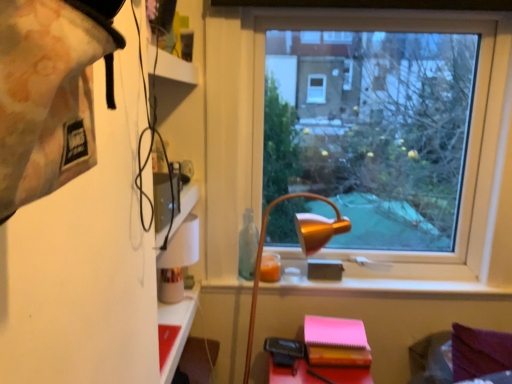
Where is `empty space that is ontop of pink matte notebook at lower right`? This screenshot has width=512, height=384. empty space that is ontop of pink matte notebook at lower right is located at coordinates (332, 325).